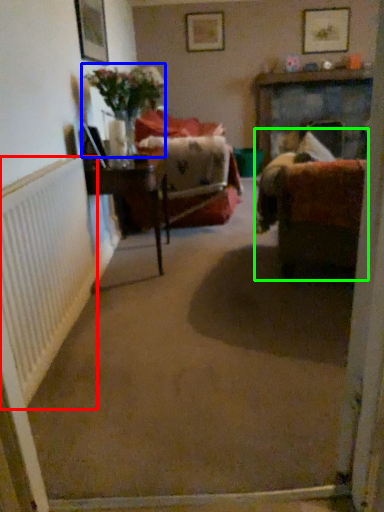
Question: Which object is positioned farthest from radiator (highlighted by a red box)? Select from floral arrangement (highlighted by a blue box) and studio couch (highlighted by a green box).

Choices:
 (A) floral arrangement
 (B) studio couch

Answer: (A)